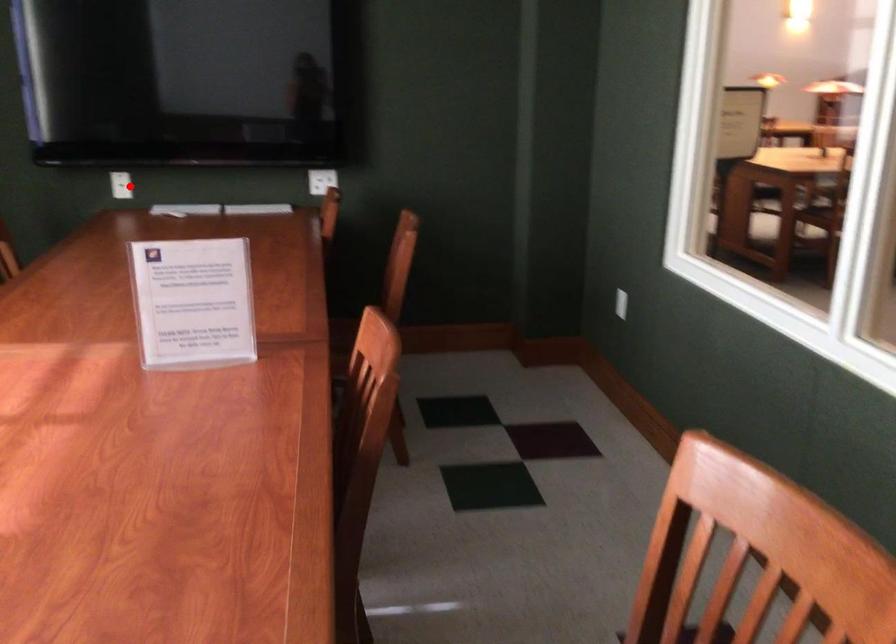
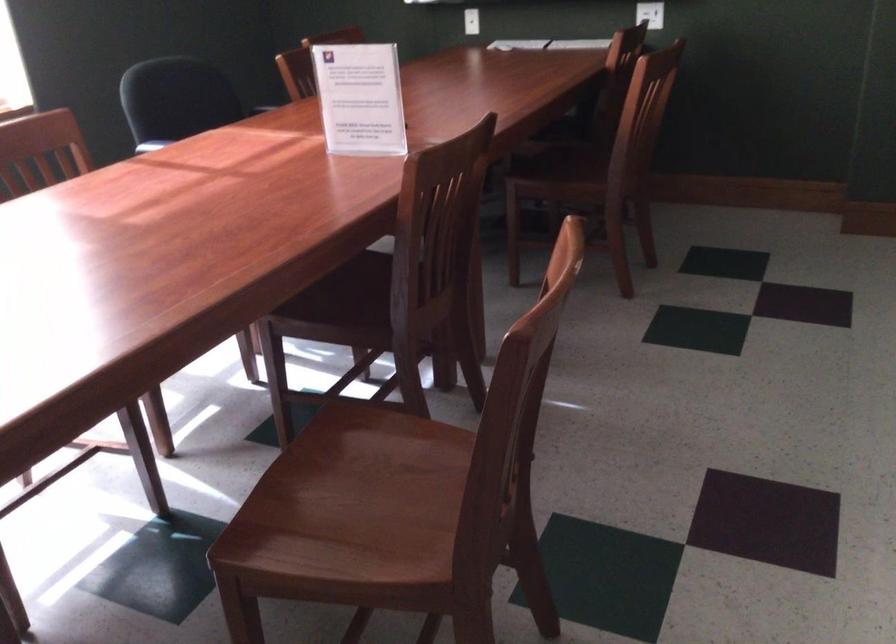
Question: I am providing you with two images of the same scene from different viewpoints. A red point is marked on the first image. Is the red point's position out of view in image 2?

Choices:
 (A) Yes
 (B) No

Answer: (B)